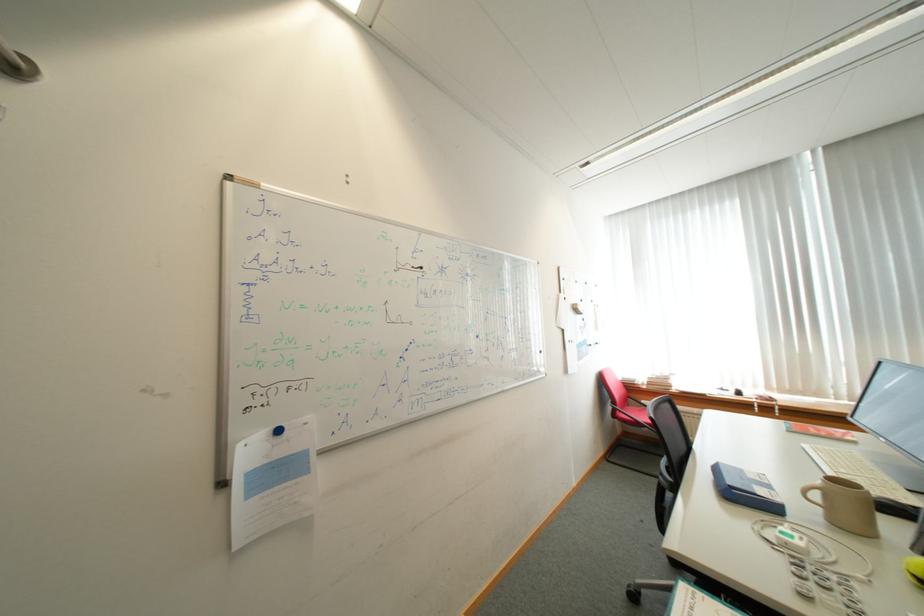
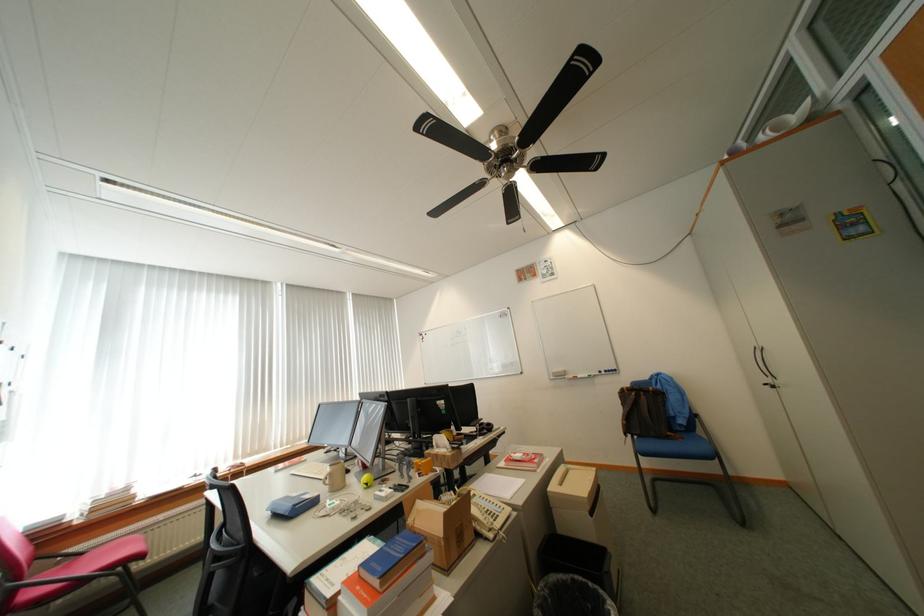
The point at (825, 498) is marked in the first image. Where is the corresponding point in the second image?

(336, 482)